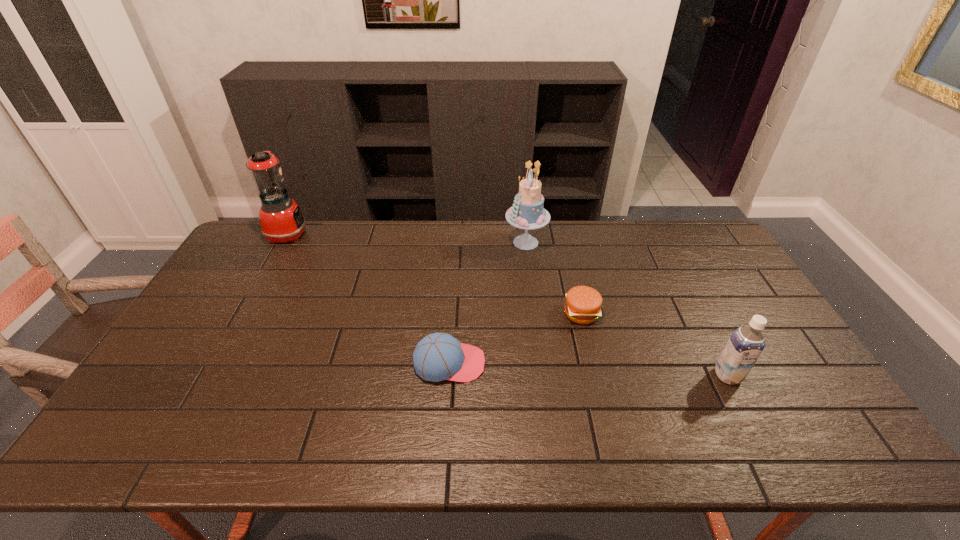
In the image, there is a desktop. Identify the location of vacant region at the near edge. click(x=186, y=446).

In the image, there is a desktop. At what (x,y) coordinates should I click in order to perform the action: click on vacant space at the left edge. Please return your answer as a coordinate pair (x, y). This screenshot has height=540, width=960. Looking at the image, I should click on (222, 281).

The height and width of the screenshot is (540, 960). Identify the location of free region at the far left corner of the desktop. (255, 228).

The width and height of the screenshot is (960, 540). In order to click on vacant area at the near left corner of the desktop in this screenshot , I will do `click(124, 447)`.

The image size is (960, 540). I want to click on vacant space in between the fourth object from right to left and the leftmost object, so click(369, 299).

Locate an element on the screen. The height and width of the screenshot is (540, 960). free space between the baseball cap and the third tallest object is located at coordinates (588, 369).

Identify the location of vacant space in between the third farthest object and the third object from left to right. (554, 278).

Locate an element on the screen. This screenshot has height=540, width=960. empty space between the soya milk and the second object from left to right is located at coordinates (588, 369).

This screenshot has height=540, width=960. I want to click on free point between the food processor and the baseball cap, so click(369, 299).

What are the coordinates of `free spot between the third object from right to left and the third nearest object` in the screenshot? It's located at (554, 278).